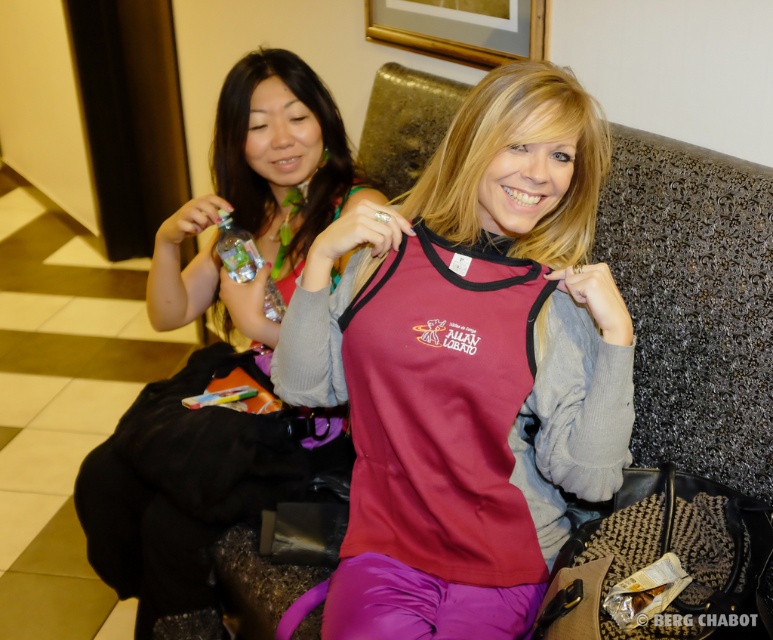
Can you confirm if matte red fabric shirt at center is smaller than matte black shirt at left?

Yes, matte red fabric shirt at center is smaller than matte black shirt at left.

Is point (581, 115) in front of point (278, 152)?

Yes, it is.

Image resolution: width=773 pixels, height=640 pixels. In order to click on matte red fabric shirt at center in this screenshot , I will do `click(468, 365)`.

Between matte red fabric shirt at center and clear plastic bottle at upper left, which one has less height?

Standing shorter between the two is clear plastic bottle at upper left.

Is matte red fabric shirt at center thinner than clear plastic bottle at upper left?

No.

Between point (363, 328) and point (220, 257), which one is positioned in front?

Point (363, 328)

At what (x,y) coordinates should I click in order to perform the action: click on matte red fabric shirt at center. Please return your answer as a coordinate pair (x, y). The image size is (773, 640). Looking at the image, I should click on (468, 365).

I want to click on matte black shirt at left, so click(x=220, y=349).

Which of these two, matte black shirt at left or clear plastic bottle at upper left, stands shorter?

With less height is clear plastic bottle at upper left.

Identify the location of matte black shirt at left. (220, 349).